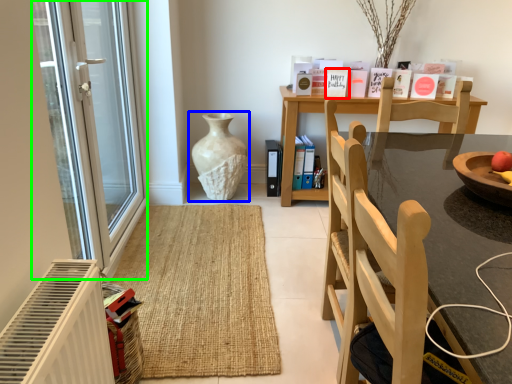
Question: Which object is positioned closest to book (highlighted by a red box)? Select from vase (highlighted by a blue box) and glass door (highlighted by a green box).

Choices:
 (A) vase
 (B) glass door

Answer: (A)